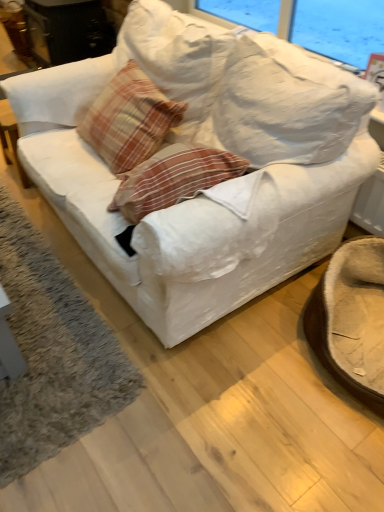
Question: Is white fabric couch at center taller than brown fuzzy swivel chair at lower right?

Choices:
 (A) no
 (B) yes

Answer: (B)

Question: Is white fabric couch at center located outside brown fuzzy swivel chair at lower right?

Choices:
 (A) yes
 (B) no

Answer: (A)

Question: Are white fabric couch at center and brown fuzzy swivel chair at lower right making contact?

Choices:
 (A) no
 (B) yes

Answer: (A)

Question: Is white fabric couch at center further to the viewer compared to brown fuzzy swivel chair at lower right?

Choices:
 (A) no
 (B) yes

Answer: (A)

Question: Is white fabric couch at center to the right of brown fuzzy swivel chair at lower right from the viewer's perspective?

Choices:
 (A) yes
 (B) no

Answer: (B)

Question: From a real-world perspective, is soft gray carpet at lower left positioned above or below white fabric couch at center?

Choices:
 (A) above
 (B) below

Answer: (B)

Question: Would you say soft gray carpet at lower left is to the left or to the right of white fabric couch at center in the picture?

Choices:
 (A) left
 (B) right

Answer: (A)

Question: Considering their positions, is soft gray carpet at lower left located in front of or behind white fabric couch at center?

Choices:
 (A) front
 (B) behind

Answer: (B)

Question: Is point (39, 373) closer or farther from the camera than point (100, 200)?

Choices:
 (A) closer
 (B) farther

Answer: (A)

Question: From the image's perspective, relative to brown fuzzy swivel chair at lower right, is plaid fabric pillow at center above or below?

Choices:
 (A) below
 (B) above

Answer: (B)

Question: Is point (134, 117) positioned closer to the camera than point (322, 358)?

Choices:
 (A) farther
 (B) closer

Answer: (A)

Question: Is plaid fabric pillow at center bigger or smaller than brown fuzzy swivel chair at lower right?

Choices:
 (A) big
 (B) small

Answer: (B)

Question: Do you think plaid fabric pillow at center is within brown fuzzy swivel chair at lower right, or outside of it?

Choices:
 (A) inside
 (B) outside

Answer: (B)

Question: Is soft gray carpet at lower left bigger or smaller than plaid fabric pillow at center?

Choices:
 (A) big
 (B) small

Answer: (B)

Question: From the image's perspective, relative to plaid fabric pillow at center, is soft gray carpet at lower left above or below?

Choices:
 (A) above
 (B) below

Answer: (B)